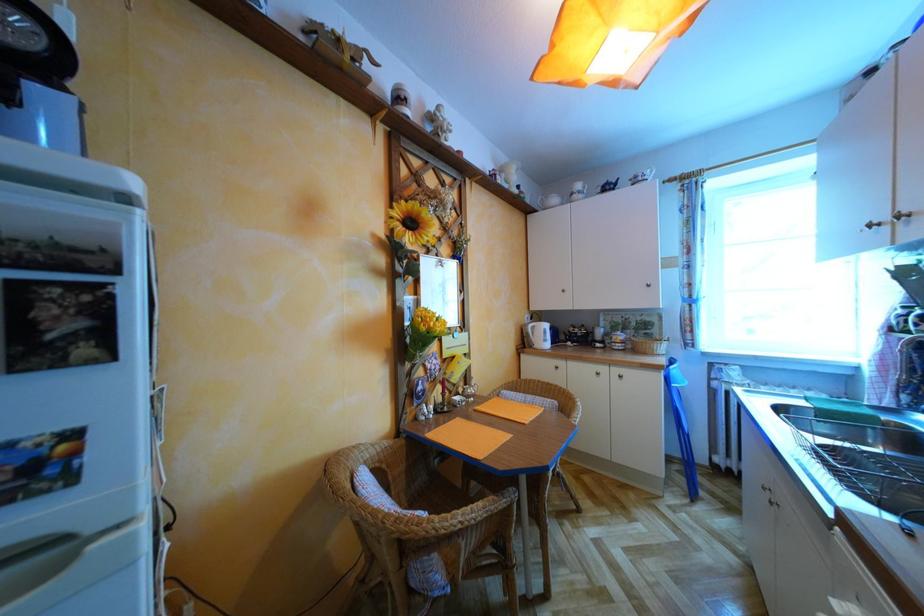
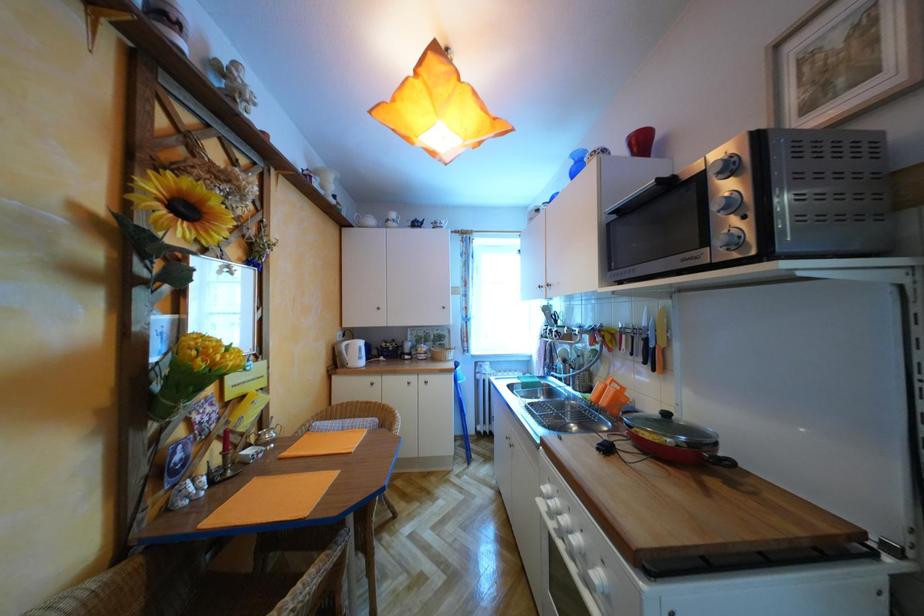
Question: The camera is either moving clockwise (left) or counter-clockwise (right) around the object. The first image is from the beginning of the video and the second image is from the end. Is the camera moving left or right when shooting the video?

Choices:
 (A) Left
 (B) Right

Answer: (A)